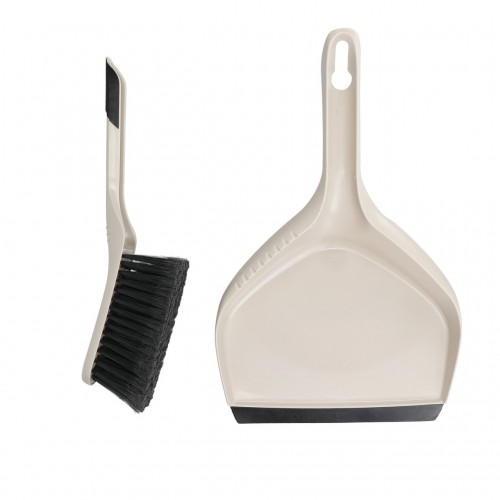
This screenshot has width=500, height=500. I want to click on hanger hole, so click(346, 72).